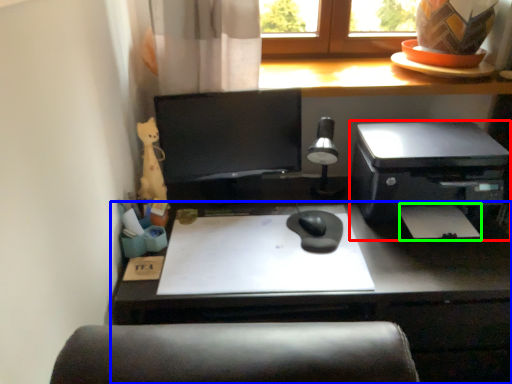
Question: Which is farther away from printer (highlighted by a red box)? desk (highlighted by a blue box) or notepad (highlighted by a green box)?

Choices:
 (A) desk
 (B) notepad

Answer: (A)